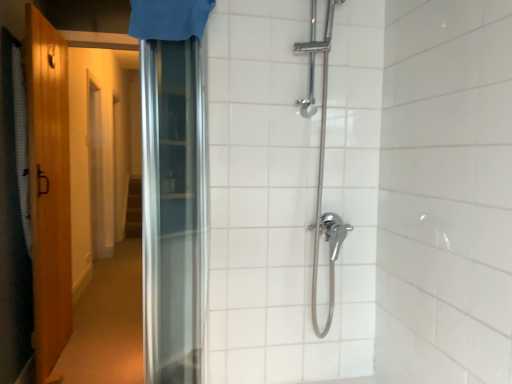
Question: In which direction should I rotate to look at blue fabric shower curtain at upper center, the 2th shower curtain positioned from the left?

Choices:
 (A) left
 (B) right

Answer: (A)

Question: Are blue fabric shower curtain at upper center, which is the 2th shower curtain in back-to-front order, and white textured shower curtain at left, arranged as the 2th shower curtain when viewed from the top, making contact?

Choices:
 (A) yes
 (B) no

Answer: (B)

Question: Can you confirm if blue fabric shower curtain at upper center, which is the 2th shower curtain in back-to-front order, is positioned to the right of white textured shower curtain at left, arranged as the 2th shower curtain when viewed from the front?

Choices:
 (A) yes
 (B) no

Answer: (A)

Question: Would you say blue fabric shower curtain at upper center, which is the 1th shower curtain in top-to-bottom order, is outside white textured shower curtain at left, which is the second shower curtain from right to left?

Choices:
 (A) no
 (B) yes

Answer: (B)

Question: From a real-world perspective, does blue fabric shower curtain at upper center, the 2th shower curtain positioned from the left, sit lower than white textured shower curtain at left, the 1th shower curtain positioned from the left?

Choices:
 (A) yes
 (B) no

Answer: (B)

Question: Is blue fabric shower curtain at upper center, which is the first shower curtain from front to back, wider than white textured shower curtain at left, which is the second shower curtain from right to left?

Choices:
 (A) no
 (B) yes

Answer: (B)

Question: Is blue fabric shower curtain at upper center, the 2th shower curtain positioned from the left, at the left side of white textured shower curtain at left, acting as the 1th shower curtain starting from the bottom?

Choices:
 (A) yes
 (B) no

Answer: (B)

Question: Is blue fabric shower curtain at upper center, which is the 2th shower curtain in back-to-front order, shorter than wooden door at left?

Choices:
 (A) no
 (B) yes

Answer: (B)

Question: Considering the relative sizes of blue fabric shower curtain at upper center, the 2th shower curtain positioned from the left, and wooden door at left in the image provided, is blue fabric shower curtain at upper center, the 2th shower curtain positioned from the left, smaller than wooden door at left?

Choices:
 (A) no
 (B) yes

Answer: (B)

Question: Can you confirm if blue fabric shower curtain at upper center, the 2th shower curtain positioned from the left, is bigger than wooden door at left?

Choices:
 (A) yes
 (B) no

Answer: (B)

Question: From the image's perspective, is blue fabric shower curtain at upper center, which is the 2th shower curtain in back-to-front order, above wooden door at left?

Choices:
 (A) no
 (B) yes

Answer: (B)

Question: Is wooden door at left located within blue fabric shower curtain at upper center, the 2th shower curtain positioned from the left?

Choices:
 (A) no
 (B) yes

Answer: (A)

Question: Is blue fabric shower curtain at upper center, the 2th shower curtain positioned from the left, behind wooden door at left?

Choices:
 (A) no
 (B) yes

Answer: (A)

Question: From the image's perspective, is wooden door at left located beneath white textured shower curtain at left, the 1th shower curtain positioned from the left?

Choices:
 (A) no
 (B) yes

Answer: (B)